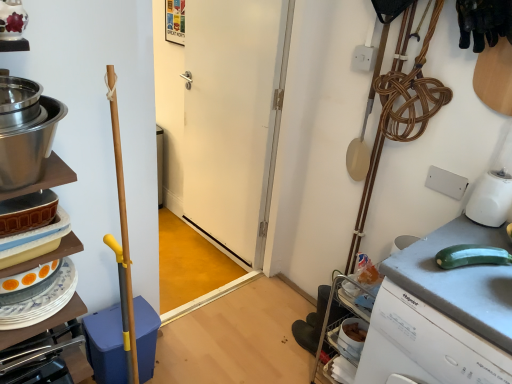
Question: Is gray matte countertop at right to the left or to the right of stainless steel bowl at left in the image?

Choices:
 (A) right
 (B) left

Answer: (A)

Question: From a real-world perspective, relative to stainless steel bowl at left, is gray matte countertop at right vertically above or below?

Choices:
 (A) above
 (B) below

Answer: (B)

Question: Which object is the closest to the stainless steel bowl at left?

Choices:
 (A) white matte door at center
 (B) gray matte countertop at right
 (C) matte ceramic dishes at left
 (D) blue plastic dish washer at left

Answer: (C)

Question: Estimate the real-world distances between objects in this image. Which object is closer to the stainless steel bowl at left?

Choices:
 (A) matte ceramic dishes at left
 (B) white matte door at center
 (C) gray matte countertop at right
 (D) blue plastic dish washer at left

Answer: (A)